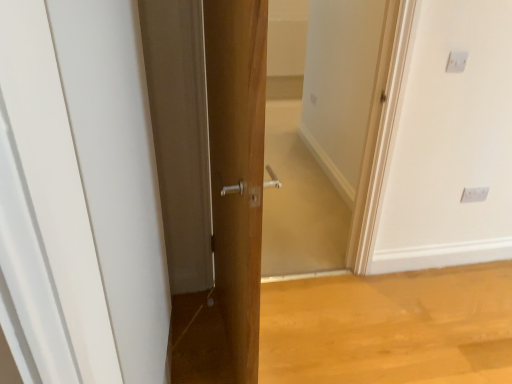
Question: Does white glossy door at center appear on the left side of white plastic electric outlet at upper right, marked as the 2th electric outlet in a top-to-bottom arrangement?

Choices:
 (A) yes
 (B) no

Answer: (A)

Question: Are white glossy door at center and white plastic electric outlet at upper right, marked as the 2th electric outlet in a top-to-bottom arrangement, far apart?

Choices:
 (A) yes
 (B) no

Answer: (A)

Question: From a real-world perspective, is white glossy door at center on top of white plastic electric outlet at upper right, which ranks as the 1th electric outlet in back-to-front order?

Choices:
 (A) no
 (B) yes

Answer: (B)

Question: Is white glossy door at center closer to the viewer compared to white plastic electric outlet at upper right, placed as the first electric outlet when sorted from bottom to top?

Choices:
 (A) no
 (B) yes

Answer: (B)

Question: Considering the relative sizes of white glossy door at center and white plastic electric outlet at upper right, which is the 2th electric outlet in left-to-right order, in the image provided, is white glossy door at center thinner than white plastic electric outlet at upper right, which is the 2th electric outlet in left-to-right order,?

Choices:
 (A) no
 (B) yes

Answer: (A)

Question: Is white glossy door at center positioned beyond the bounds of white plastic electric outlet at upper right, which is counted as the first electric outlet, starting from the right?

Choices:
 (A) no
 (B) yes

Answer: (B)

Question: Could you tell me if white glossy door at center is facing white plastic electric outlet at upper right, placed as the second electric outlet when sorted from right to left?

Choices:
 (A) no
 (B) yes

Answer: (B)

Question: Does white glossy door at center have a lesser width compared to white plastic electric outlet at upper right, which appears as the 1th electric outlet when viewed from the top?

Choices:
 (A) yes
 (B) no

Answer: (B)

Question: From a real-world perspective, is white glossy door at center physically below white plastic electric outlet at upper right, the 2th electric outlet when ordered from back to front?

Choices:
 (A) no
 (B) yes

Answer: (B)

Question: From a real-world perspective, does white glossy door at center stand above white plastic electric outlet at upper right, placed as the second electric outlet when sorted from right to left?

Choices:
 (A) yes
 (B) no

Answer: (B)

Question: From the image's perspective, would you say white glossy door at center is positioned over white plastic electric outlet at upper right, which appears as the 1th electric outlet when viewed from the top?

Choices:
 (A) yes
 (B) no

Answer: (B)

Question: Are white glossy door at center and white plastic electric outlet at upper right, which appears as the 1th electric outlet when viewed from the top, beside each other?

Choices:
 (A) yes
 (B) no

Answer: (B)

Question: Is white plastic electric outlet at upper right, marked as the first electric outlet in a left-to-right arrangement, positioned in front of white glossy door at center?

Choices:
 (A) yes
 (B) no

Answer: (B)